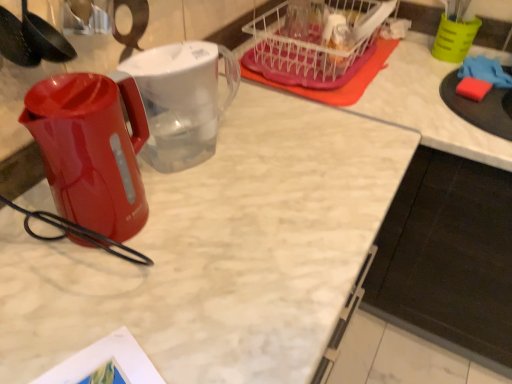
Image resolution: width=512 pixels, height=384 pixels. What are the coordinates of `vacant area that lies in front of translucent plastic basket at upper right` in the screenshot? It's located at (349, 115).